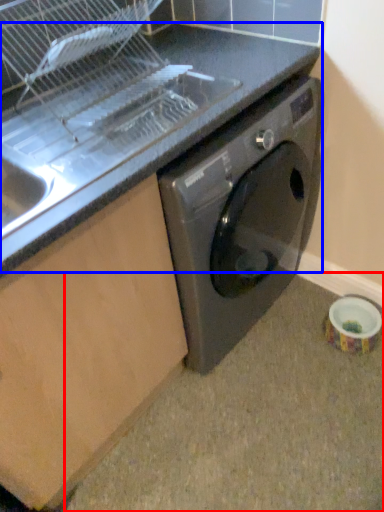
Question: Which object is further to the camera taking this photo, granite (highlighted by a red box) or counter top (highlighted by a blue box)?

Choices:
 (A) granite
 (B) counter top

Answer: (A)